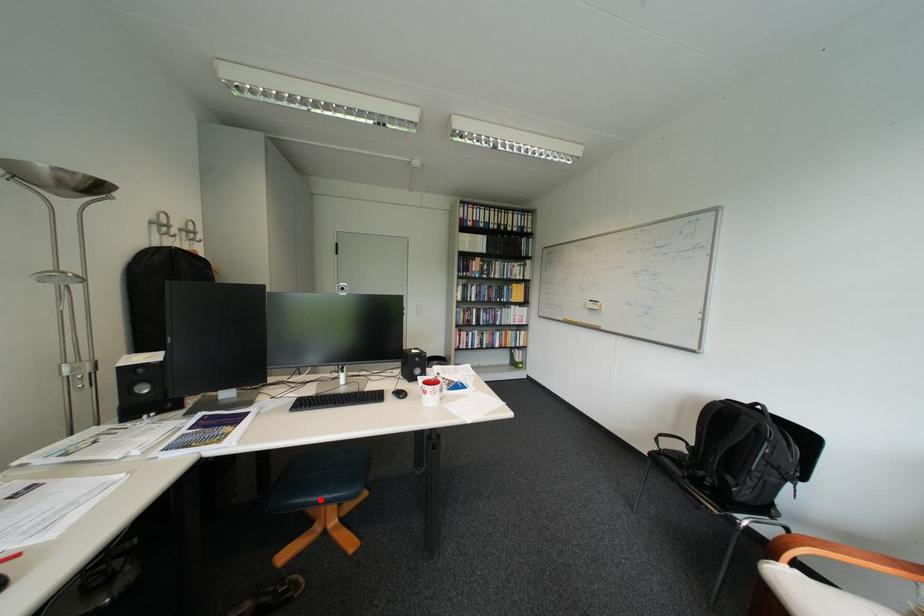
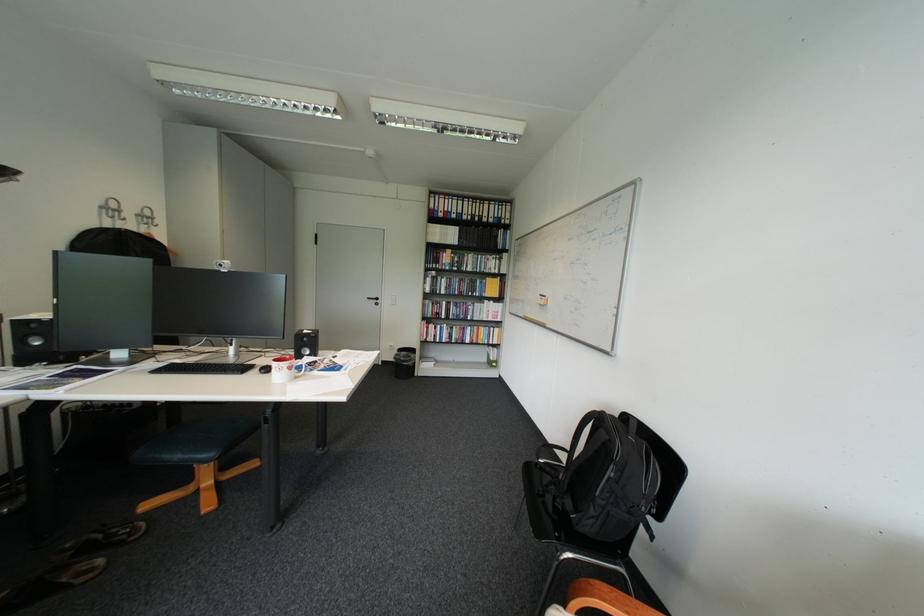
In the second image, find the point that corresponds to the highlighted location in the first image.

(176, 456)